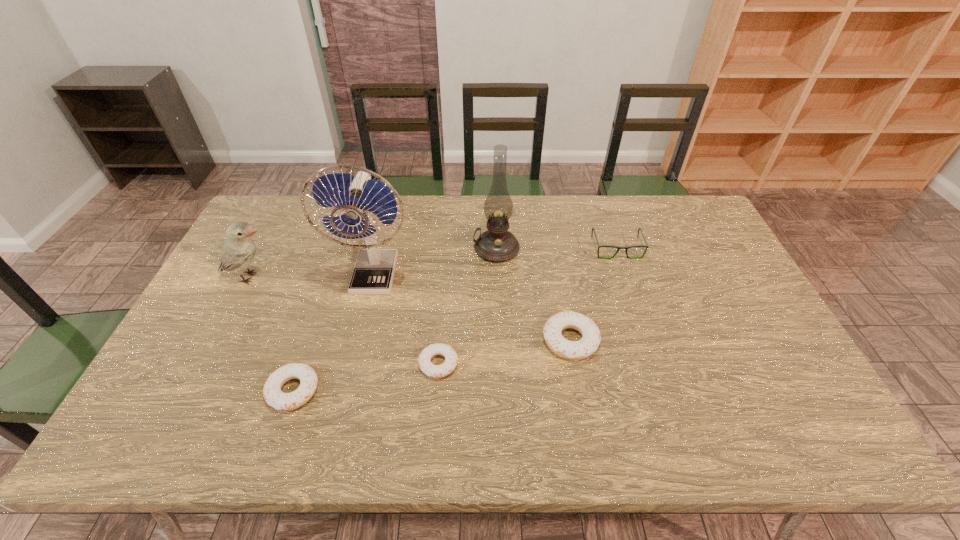
Locate an element on the screen. the second shortest object is located at coordinates (272, 393).

At what (x,y) coordinates should I click in order to perform the action: click on the leftmost doughnut. Please return your answer as a coordinate pair (x, y). This screenshot has height=540, width=960. Looking at the image, I should click on (272, 393).

Where is `the fourth object from right to left`? The image size is (960, 540). the fourth object from right to left is located at coordinates (424, 361).

I want to click on the shortest object, so click(x=424, y=361).

This screenshot has height=540, width=960. Identify the location of the second object from right to left. (574, 350).

Identify the location of the tallest doughnut. This screenshot has height=540, width=960. (574, 350).

The width and height of the screenshot is (960, 540). Identify the location of spectacles. (618, 247).

Find the location of a particular element. The width and height of the screenshot is (960, 540). fan is located at coordinates (373, 274).

In order to click on oil lamp in this screenshot , I will do `click(496, 244)`.

Image resolution: width=960 pixels, height=540 pixels. What are the coordinates of `bird` in the screenshot? It's located at (238, 252).